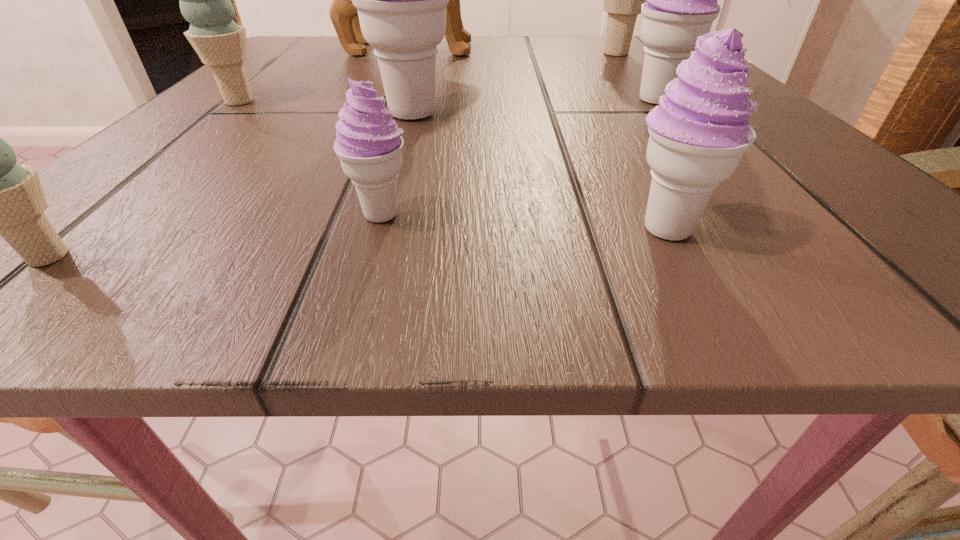
Identify the location of free area in between the biggest blue ice cream and the tallest ice cream. The width and height of the screenshot is (960, 540). (514, 84).

Locate an element on the screen. This screenshot has width=960, height=540. vacant point located between the second purple icecream from right to left and the second farthest blue ice cream is located at coordinates (452, 165).

Identify the location of vacant region between the biggest purple icecream and the sixth object from left to right. Image resolution: width=960 pixels, height=540 pixels. (539, 172).

Identify the location of empty location between the second tallest object and the sixth object from left to right. Image resolution: width=960 pixels, height=540 pixels. (539, 172).

This screenshot has width=960, height=540. In order to click on unoccupied position between the tallest ice cream and the sixth object from left to right in this screenshot , I will do `click(539, 172)`.

Find the location of `empty location between the smallest purple icecream and the third purple icecream from left to right`. empty location between the smallest purple icecream and the third purple icecream from left to right is located at coordinates (523, 222).

This screenshot has height=540, width=960. What are the coordinates of `object that can be found as the closest to the biggest purple icecream` in the screenshot? It's located at (204, 0).

Select which object is the second closest to the biggest purple icecream. Please provide its 2D coordinates. Your answer should be formatted as a tuple, i.e. [(x, y)], where the tuple contains the x and y coordinates of a point satisfying the conditions above.

[(369, 144)]

Select which ice cream appears as the seventh closest to the tallest object. Please provide its 2D coordinates. Your answer should be formatted as a tuple, i.e. [(x, y)], where the tuple contains the x and y coordinates of a point satisfying the conditions above.

[(0, 197)]

Identify which ice cream is the sixth nearest to the farthest ice cream. Please provide its 2D coordinates. Your answer should be formatted as a tuple, i.e. [(x, y)], where the tuple contains the x and y coordinates of a point satisfying the conditions above.

[(0, 197)]